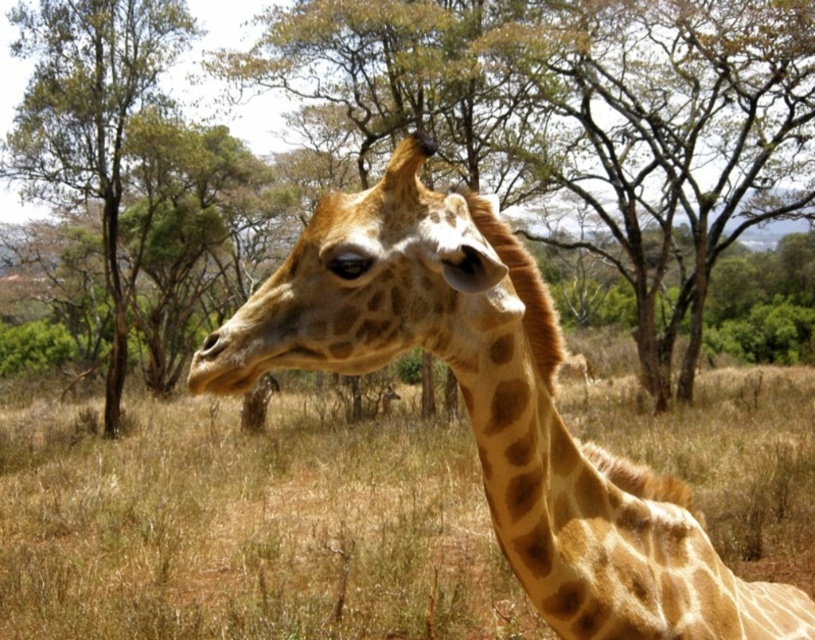
Question: Does brown dry grass at center have a greater width compared to brown textured tree at center?

Choices:
 (A) yes
 (B) no

Answer: (B)

Question: Which object appears closest to the camera in this image?

Choices:
 (A) brown wood tree at center
 (B) brown dry grass at center
 (C) brown textured tree at center

Answer: (B)

Question: Which of the following is the closest to the observer?

Choices:
 (A) [355, 307]
 (B) [113, 413]
 (C) [14, 74]
 (D) [278, 420]

Answer: (A)

Question: Does brown dry grass at center come behind spotted fur giraffe at center?

Choices:
 (A) yes
 (B) no

Answer: (A)

Question: Does brown dry grass at center have a lesser width compared to spotted fur giraffe at center?

Choices:
 (A) yes
 (B) no

Answer: (B)

Question: Among these objects, which one is nearest to the camera?

Choices:
 (A) brown dry grass at center
 (B) brown wood tree at center
 (C) spotted fur giraffe at center
 (D) brown textured tree at center

Answer: (C)